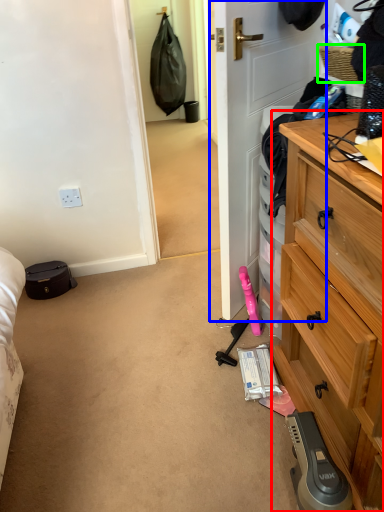
Question: Which object is the farthest from chest of drawers (highlighted by a red box)? Choose among these: door (highlighted by a blue box) or picnic basket (highlighted by a green box).

Choices:
 (A) door
 (B) picnic basket

Answer: (B)